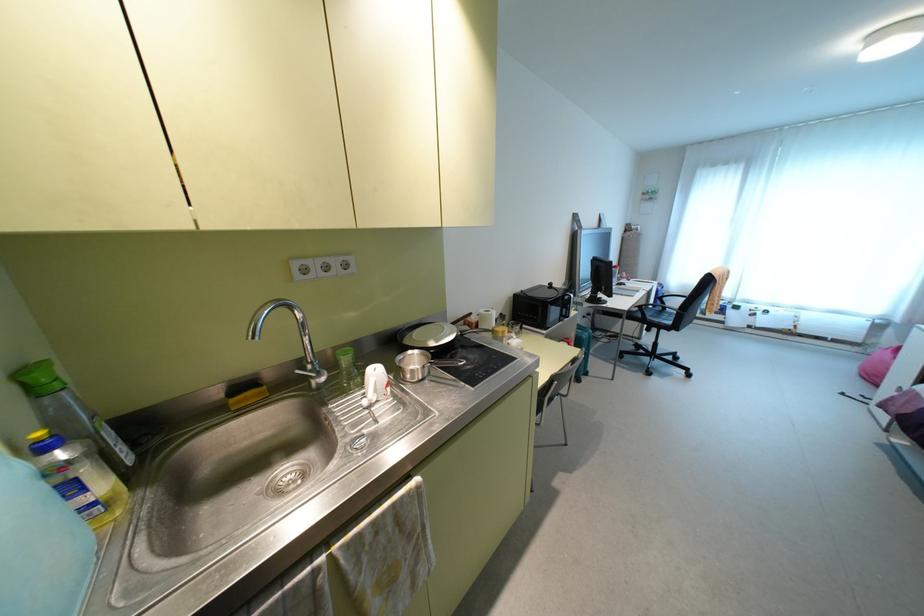
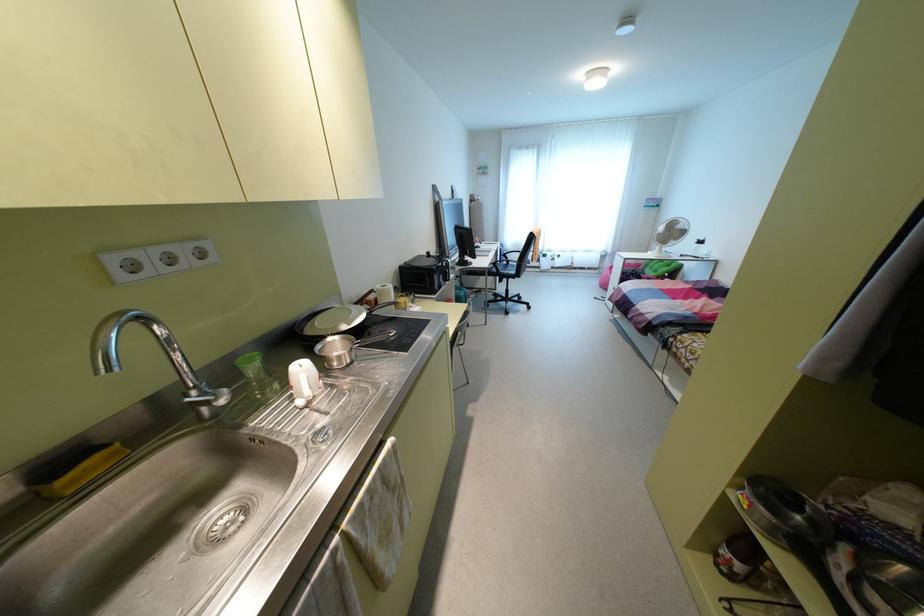
Find the pixel in the second image that matches (x=344, y=359) in the first image.

(251, 366)